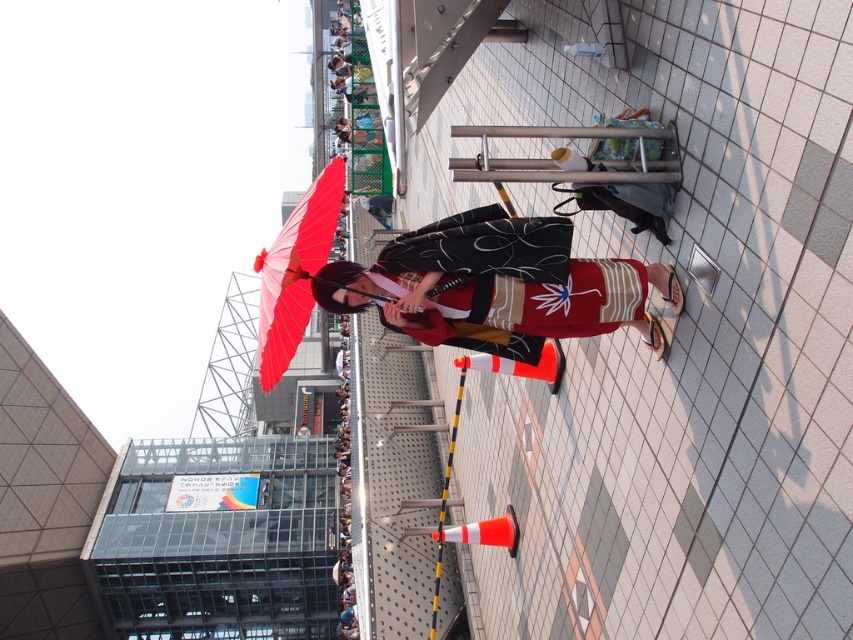
You are a photographer trying to capture the person in the matte kimono at center and the matte red umbrella at center. Since you want to ensure both are in focus, which object should you adjust your camera settings to prioritize focusing on first?

The matte kimono at center is smaller than the matte red umbrella at center. To ensure both are in focus, prioritize focusing on the matte kimono at center first as it is smaller and might require more precise focus.

You are a photographer trying to capture the scene of the matte kimono at center and the matte red umbrella at center. If you want to ensure both objects are fully visible in your shot, which object should you consider the width of when framing your composition?

The matte kimono at center might be wider than the matte red umbrella at center, so you should consider the width of the matte kimono at center to ensure both are fully visible.